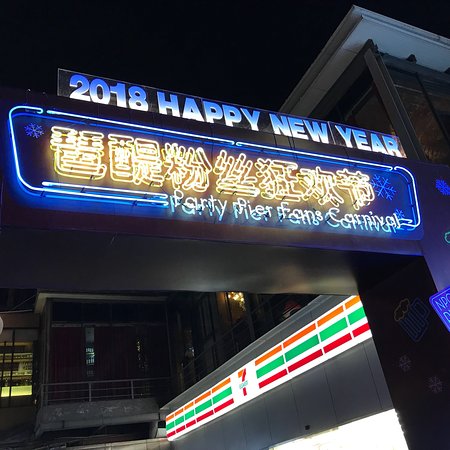
The height and width of the screenshot is (450, 450). I want to click on light, so [x=18, y=379].